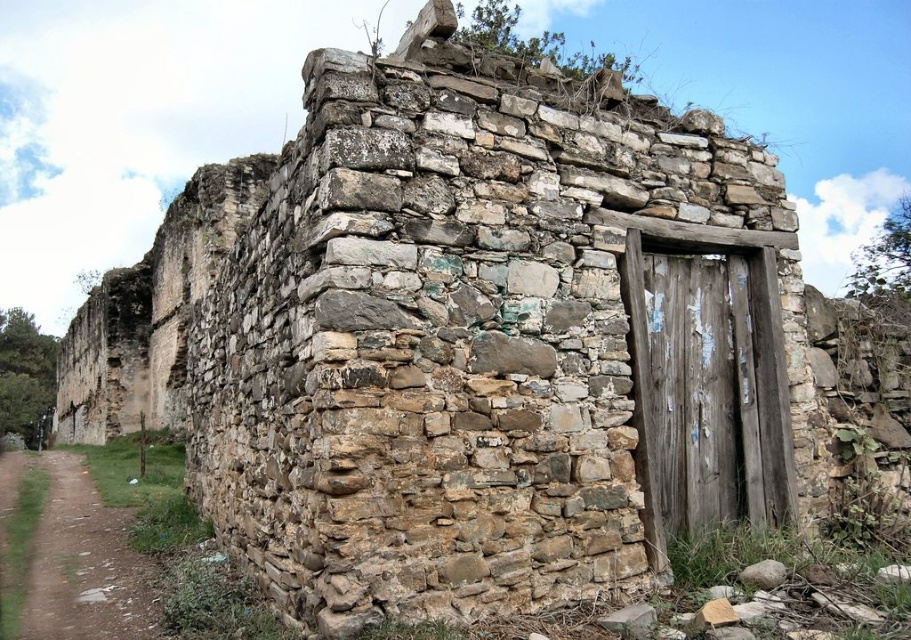
Is weathered wood door at right further to camera compared to dirt/gravel path at lower left?

Yes, it is behind dirt/gravel path at lower left.

Does point (737, 355) come closer to viewer compared to point (65, 456)?

Yes.

Identify the location of weathered wood door at right. (707, 388).